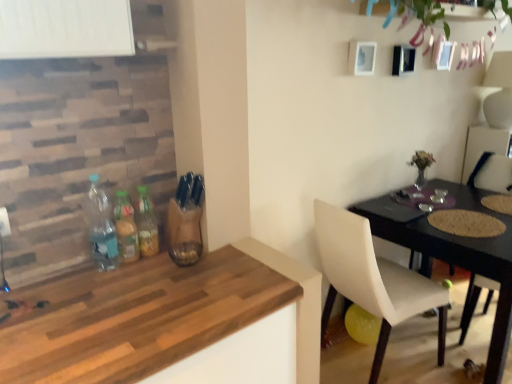
Where is `free space above wooden table at lower left (from a real-world perspective)`? The image size is (512, 384). free space above wooden table at lower left (from a real-world perspective) is located at coordinates (101, 306).